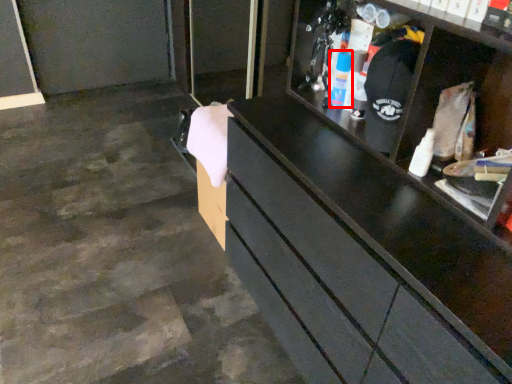
Question: Observing the image, what is the correct spatial positioning of toiletry (annotated by the red box) in reference to toiletry?

Choices:
 (A) right
 (B) left

Answer: (B)